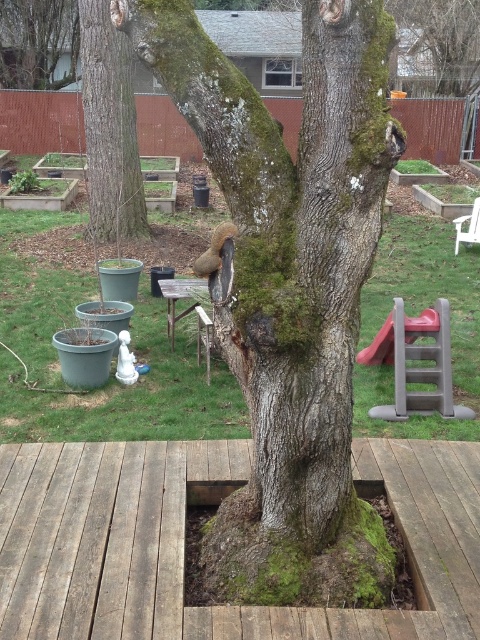
Can you confirm if weathered wood deck at center is bigger than green mossy tree trunk at upper left?

Actually, weathered wood deck at center might be smaller than green mossy tree trunk at upper left.

Is weathered wood deck at center closer to camera compared to green mossy tree trunk at upper left?

Yes.

The image size is (480, 640). What do you see at coordinates (183, 538) in the screenshot? I see `weathered wood deck at center` at bounding box center [183, 538].

What are the coordinates of `weathered wood deck at center` in the screenshot? It's located at (183, 538).

Does weathered wood deck at center have a smaller size compared to green mossy tree trunk at center?

Indeed, weathered wood deck at center has a smaller size compared to green mossy tree trunk at center.

Is weathered wood deck at center bigger than green mossy tree trunk at center?

Incorrect, weathered wood deck at center is not larger than green mossy tree trunk at center.

This screenshot has width=480, height=640. Describe the element at coordinates (183, 538) in the screenshot. I see `weathered wood deck at center` at that location.

Where is `weathered wood deck at center`? weathered wood deck at center is located at coordinates (183, 538).

Measure the distance between green mossy bark tree at center and camera.

green mossy bark tree at center and camera are 2.03 meters apart from each other.

Locate an element on the screen. green mossy bark tree at center is located at coordinates (289, 291).

Where is `green mossy bark tree at center`? green mossy bark tree at center is located at coordinates (289, 291).